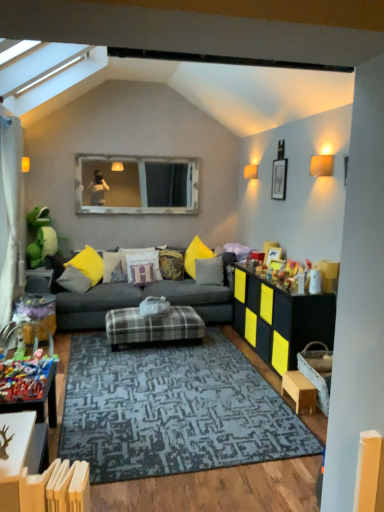
This screenshot has height=512, width=384. What do you see at coordinates (11, 215) in the screenshot?
I see `white fabric curtain at left` at bounding box center [11, 215].

The height and width of the screenshot is (512, 384). What are the coordinates of `matte black cabinet at right, which appears as the 4th table when viewed from the left` in the screenshot? It's located at (280, 319).

Where is `velvet yellow pillow at center, the 2th pillow viewed from the left`? The image size is (384, 512). velvet yellow pillow at center, the 2th pillow viewed from the left is located at coordinates (114, 267).

Identify the location of wooden table at lower left, the fourth table when ordered from back to front. (18, 454).

Locate an element on the screen. white fabric curtain at left is located at coordinates (11, 215).

From the picture: From the image's perspective, is textured yellow pillow at center, positioned as the 5th pillow in left-to-right order, below green plush toy at left, which is the second toy in right-to-left order?

Yes.

From a real-world perspective, is textured yellow pillow at center, positioned as the 5th pillow in left-to-right order, above or below green plush toy at left, which ranks as the 1th toy in left-to-right order?

From a real-world perspective, textured yellow pillow at center, positioned as the 5th pillow in left-to-right order, is physically below green plush toy at left, which ranks as the 1th toy in left-to-right order.

In the scene shown: Considering the sizes of objects textured yellow pillow at center, which is counted as the second pillow, starting from the right, and green plush toy at left, which is the second toy in right-to-left order, in the image provided, who is shorter, textured yellow pillow at center, which is counted as the second pillow, starting from the right, or green plush toy at left, which is the second toy in right-to-left order,?

Standing shorter between the two is textured yellow pillow at center, which is counted as the second pillow, starting from the right.

Is textured yellow pillow at center, which is counted as the second pillow, starting from the right, oriented towards green plush toy at left, which ranks as the first toy in back-to-front order?

No, textured yellow pillow at center, which is counted as the second pillow, starting from the right, is not turned towards green plush toy at left, which ranks as the first toy in back-to-front order.

From the picture: From the image's perspective, is wooden-framed mirror at upper center located above white fabric curtain at left?

Correct, wooden-framed mirror at upper center appears higher than white fabric curtain at left in the image.

Is wooden-framed mirror at upper center with white fabric curtain at left?

No, wooden-framed mirror at upper center is not in contact with white fabric curtain at left.

How many degrees apart are the facing directions of wooden-framed mirror at upper center and white fabric curtain at left?

The angle between the facing direction of wooden-framed mirror at upper center and the facing direction of white fabric curtain at left is 88.2 degrees.

From a real-world perspective, is matte gray fabric couch at center on top of purple velvet pillow at center, placed as the 3th pillow when sorted from right to left?

Actually, matte gray fabric couch at center is physically below purple velvet pillow at center, placed as the 3th pillow when sorted from right to left, in the real world.

Would you say matte gray fabric couch at center is outside purple velvet pillow at center, placed as the 3th pillow when sorted from right to left?

Indeed, matte gray fabric couch at center is completely outside purple velvet pillow at center, placed as the 3th pillow when sorted from right to left.

Considering the relative positions of matte gray fabric couch at center and purple velvet pillow at center, placed as the 3th pillow when sorted from right to left, in the image provided, is matte gray fabric couch at center to the right of purple velvet pillow at center, placed as the 3th pillow when sorted from right to left, from the viewer's perspective?

No.

Looking at their sizes, would you say matte gray fabric couch at center is wider or thinner than purple velvet pillow at center, placed as the 3th pillow when sorted from right to left?

In the image, matte gray fabric couch at center appears to be wider than purple velvet pillow at center, placed as the 3th pillow when sorted from right to left.

Which is in front, point (294, 394) or point (36, 262)?

Positioned in front is point (294, 394).

Which of these two, wooden table at lower right, the 3th table in the back-to-front sequence, or green plush toy at left, which ranks as the 1th toy in left-to-right order, is smaller?

wooden table at lower right, the 3th table in the back-to-front sequence, is smaller.

Is wooden table at lower right, which appears as the third table when viewed from the left, situated inside green plush toy at left, acting as the 2th toy starting from the front, or outside?

wooden table at lower right, which appears as the third table when viewed from the left, cannot be found inside green plush toy at left, acting as the 2th toy starting from the front.

Visually, is wooden table at lower right, acting as the 2th table starting from the front, positioned to the left or to the right of green plush toy at left, which is the second toy in right-to-left order?

wooden table at lower right, acting as the 2th table starting from the front, is positioned on green plush toy at left, which is the second toy in right-to-left order,'s right side.

Is wooden table at lower right, the second table in the right-to-left sequence, taller than matte gray fabric couch at center?

In fact, wooden table at lower right, the second table in the right-to-left sequence, may be shorter than matte gray fabric couch at center.

From a real-world perspective, is wooden table at lower right, which appears as the third table when viewed from the left, on matte gray fabric couch at center?

No, from a real-world perspective, wooden table at lower right, which appears as the third table when viewed from the left, is not above matte gray fabric couch at center.

Image resolution: width=384 pixels, height=512 pixels. I want to click on studio couch that appears above the wooden table at lower right, which appears as the third table when viewed from the left (from the image's perspective), so (141, 300).

You are a GUI agent. You are given a task and a screenshot of the screen. Output one action in this format:
    pyautogui.click(x=<x>, y=<y>)
    Task: Click on the table above the yellow fabric pillow at center, acting as the sixth pillow starting from the right (from a real-world perspective)
    Image resolution: width=384 pixels, height=512 pixels.
    Given the screenshot: What is the action you would take?
    pyautogui.click(x=18, y=454)

Is wooden table at lower left, the 4th table positioned from the right, aimed at yellow fabric pillow at center, the first pillow when ordered from left to right?

No.

Is wooden table at lower left, positioned as the 1th table in front-to-back order, to the left of yellow fabric pillow at center, the first pillow when ordered from left to right, from the viewer's perspective?

Incorrect, wooden table at lower left, positioned as the 1th table in front-to-back order, is not on the left side of yellow fabric pillow at center, the first pillow when ordered from left to right.

From the image's perspective, is wooden table at lower left, positioned as the 1th table in front-to-back order, above plastic toy at lower left, placed as the 1th toy when sorted from right to left?

Yes, from the image's perspective, wooden table at lower left, positioned as the 1th table in front-to-back order, is on top of plastic toy at lower left, placed as the 1th toy when sorted from right to left.

Can you tell me how much wooden table at lower left, the fourth table when ordered from back to front, and plastic toy at lower left, the 1th toy positioned from the front, differ in facing direction?

3.55 degrees.

Visually, is wooden table at lower left, positioned as the 1th table in front-to-back order, positioned to the left or to the right of plastic toy at lower left, placed as the 1th toy when sorted from right to left?

wooden table at lower left, positioned as the 1th table in front-to-back order, is positioned on plastic toy at lower left, placed as the 1th toy when sorted from right to left,'s right side.

The height and width of the screenshot is (512, 384). What are the coordinates of `toy above the textured yellow pillow at center, which is counted as the second pillow, starting from the right (from a real-world perspective)` in the screenshot? It's located at (x=41, y=237).

Where is `curtain below the wooden-framed mirror at upper center (from the image's perspective)`? The image size is (384, 512). curtain below the wooden-framed mirror at upper center (from the image's perspective) is located at coordinates (11, 215).

Looking at the image, which one is located closer to wooden table at lower right, acting as the 2th table starting from the front, velvet yellow pillow at center, arranged as the third pillow when viewed from the left, or matte black cabinet at right, which appears as the 4th table when viewed from the left?

Based on the image, matte black cabinet at right, which appears as the 4th table when viewed from the left, appears to be nearer to wooden table at lower right, acting as the 2th table starting from the front.

Considering their positions, is white fabric curtain at left positioned further to textured yellow pillow at center, which is counted as the second pillow, starting from the right, than purple velvet pillow at center, placed as the 3th pillow when sorted from right to left?

A: white fabric curtain at left is positioned further to the anchor textured yellow pillow at center, which is counted as the second pillow, starting from the right.

From the picture: From the image, which object appears to be farther from green plush toy at left, which ranks as the 1th toy in left-to-right order, textured yellow pillow at center, which is counted as the second pillow, starting from the right, or gray fabric pillow at center, the 1th pillow in the right-to-left sequence?

gray fabric pillow at center, the 1th pillow in the right-to-left sequence, lies further to green plush toy at left, which ranks as the 1th toy in left-to-right order, than the other object.

Based on their spatial positions, is yellow fabric pillow at center, acting as the sixth pillow starting from the right, or wooden table at lower left, the fourth table when ordered from back to front, further from velvet yellow pillow at center, the 2th pillow viewed from the left?

Based on the image, wooden table at lower left, the fourth table when ordered from back to front, appears to be further to velvet yellow pillow at center, the 2th pillow viewed from the left.

Estimate the real-world distances between objects in this image. Which object is closer to matte gray fabric couch at center, matte black cabinet at right, which appears as the 3th table when viewed from the front, or wooden table at lower right, the second table in the right-to-left sequence?

The object closer to matte gray fabric couch at center is matte black cabinet at right, which appears as the 3th table when viewed from the front.

Based on their spatial positions, is velvet yellow pillow at center, the fourth pillow from the right, or plastic toy at lower left, the second toy viewed from the back, further from green plush toy at left, acting as the 2th toy starting from the front?

plastic toy at lower left, the second toy viewed from the back.

In the scene shown: Estimate the real-world distances between objects in this image. Which object is further from wooden table at lower left, the 4th table positioned from the right, velvet yellow pillow at center, the fourth pillow from the right, or velvet yellow pillow at center, the 2th pillow viewed from the left?

velvet yellow pillow at center, the 2th pillow viewed from the left, is positioned further to the anchor wooden table at lower left, the 4th table positioned from the right.

From the image, which object appears to be farther from gray fabric pillow at center, which is counted as the sixth pillow, starting from the left, wooden table at lower left, the first table when ordered from left to right, or plaid fabric ottoman at center, the 4th table in the front-to-back sequence?

Based on the image, wooden table at lower left, the first table when ordered from left to right, appears to be further to gray fabric pillow at center, which is counted as the sixth pillow, starting from the left.

Locate an element on the screen. This screenshot has height=512, width=384. toy positioned between wooden table at lower left, the first table when ordered from left to right, and green plush toy at left, which ranks as the first toy in back-to-front order, from near to far is located at coordinates (25, 371).

This screenshot has height=512, width=384. Find the location of `studio couch between white fabric curtain at left and purple velvet pillow at center, which is counted as the 4th pillow, starting from the left`. studio couch between white fabric curtain at left and purple velvet pillow at center, which is counted as the 4th pillow, starting from the left is located at coordinates (141, 300).

Find the location of a particular element. The width and height of the screenshot is (384, 512). table located between matte black cabinet at right, acting as the 2th table starting from the back, and textured yellow pillow at center, which is counted as the second pillow, starting from the right, in the depth direction is located at coordinates (153, 326).

Locate an element on the screen. studio couch between green plush toy at left, which ranks as the 1th toy in left-to-right order, and gray fabric pillow at center, which is counted as the sixth pillow, starting from the left, from left to right is located at coordinates (141, 300).